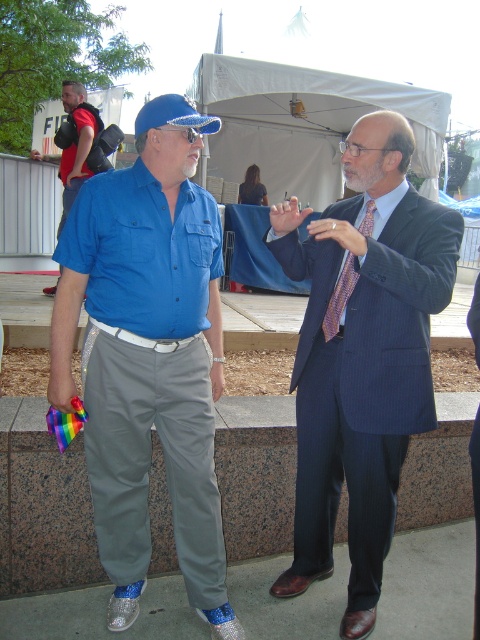
You are standing at the entrance of the event and want to find the silky blue suit at center. Which direction should you look relative to the white fabric canopy at upper center?

The white fabric canopy at upper center is to the left of the silky blue suit at center, so you should look to the right of the white fabric canopy at upper center to find the silky blue suit at center.

You are a photographer at the event and want to capture both the silky blue suit at center and the blue beaded goggles at center in a single frame. Which object should you focus on first to ensure both are in the shot?

The silky blue suit at center is positioned under blue beaded goggles at center, so you should focus on the blue beaded goggles at center first to ensure both are in the shot.

You are planning to hang a banner that is 3 meters wide between the white fabric canopy at upper center and the silky blue suit at center. Will the banner fit horizontally if you place it between them?

The white fabric canopy at upper center is wider than the silky blue suit at center. Since the banner is 3 meters wide, it depends on the actual width of the canopy and suit. However, without specific measurements, we cannot confirm if the banner will fit. Please measure the space first.